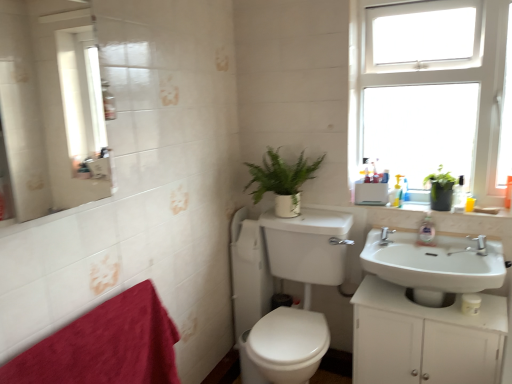
Question: Is translucent plastic soap dispenser at upper right, which is the second toiletry in right-to-left order, smaller than green matte plant at center?

Choices:
 (A) no
 (B) yes

Answer: (B)

Question: Considering the relative sizes of translucent plastic soap dispenser at upper right, placed as the 1th toiletry when sorted from left to right, and green matte plant at center in the image provided, is translucent plastic soap dispenser at upper right, placed as the 1th toiletry when sorted from left to right, wider than green matte plant at center?

Choices:
 (A) yes
 (B) no

Answer: (B)

Question: Is translucent plastic soap dispenser at upper right, placed as the 1th toiletry when sorted from left to right, looking in the opposite direction of green matte plant at center?

Choices:
 (A) yes
 (B) no

Answer: (B)

Question: Is translucent plastic soap dispenser at upper right, placed as the 1th toiletry when sorted from left to right, behind green matte plant at center?

Choices:
 (A) no
 (B) yes

Answer: (B)

Question: Can you confirm if translucent plastic soap dispenser at upper right, arranged as the 1th toiletry when viewed from the back, is shorter than green matte plant at center?

Choices:
 (A) no
 (B) yes

Answer: (B)

Question: Considering the relative positions of translucent plastic soap dispenser at upper right, placed as the 1th toiletry when sorted from left to right, and green matte plant at center in the image provided, is translucent plastic soap dispenser at upper right, placed as the 1th toiletry when sorted from left to right, to the right of green matte plant at center from the viewer's perspective?

Choices:
 (A) yes
 (B) no

Answer: (A)

Question: Is white plastic window at upper right positioned behind silver metallic faucet at upper right?

Choices:
 (A) yes
 (B) no

Answer: (B)

Question: Is white plastic window at upper right aimed at silver metallic faucet at upper right?

Choices:
 (A) yes
 (B) no

Answer: (A)

Question: From a real-world perspective, is white plastic window at upper right located beneath silver metallic faucet at upper right?

Choices:
 (A) no
 (B) yes

Answer: (A)

Question: Is white plastic window at upper right in contact with silver metallic faucet at upper right?

Choices:
 (A) yes
 (B) no

Answer: (B)

Question: From a real-world perspective, is white plastic window at upper right on silver metallic faucet at upper right?

Choices:
 (A) no
 (B) yes

Answer: (B)

Question: Considering the relative sizes of white plastic window at upper right and silver metallic faucet at upper right in the image provided, is white plastic window at upper right smaller than silver metallic faucet at upper right?

Choices:
 (A) no
 (B) yes

Answer: (A)

Question: Is the position of white matte cabinet at lower right less distant than that of green matte plant at upper right?

Choices:
 (A) yes
 (B) no

Answer: (A)